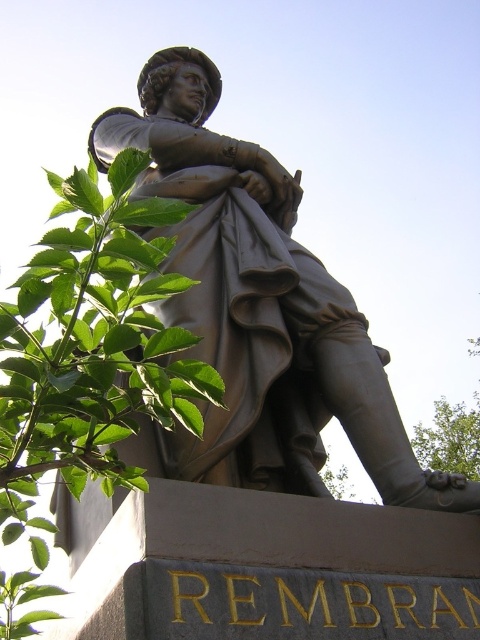
Question: Which point appears farthest from the camera in this image?

Choices:
 (A) (308, 490)
 (B) (70, 204)

Answer: (A)

Question: From the image, what is the correct spatial relationship of bronze statue at center in relation to green leafy branch at upper left?

Choices:
 (A) left
 (B) right

Answer: (B)

Question: Which point is closer to the camera taking this photo?

Choices:
 (A) (120, 353)
 (B) (254, 257)

Answer: (A)

Question: Is bronze statue at center behind green leafy branch at upper left?

Choices:
 (A) no
 (B) yes

Answer: (B)

Question: Is bronze statue at center above green leafy branch at upper left?

Choices:
 (A) no
 (B) yes

Answer: (B)